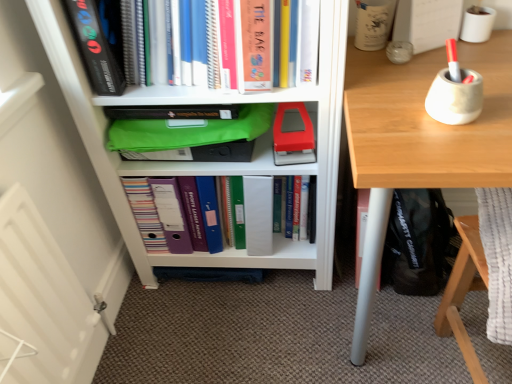
What is the approximate width of light wood desk at right?

24.68 inches.

What do you see at coordinates (399, 51) in the screenshot? The height and width of the screenshot is (384, 512). I see `clear glass jar at upper right, the second stationery in the left-to-right sequence` at bounding box center [399, 51].

The image size is (512, 384). Find the location of `clear glass jar at upper right, the second stationery in the left-to-right sequence`. clear glass jar at upper right, the second stationery in the left-to-right sequence is located at coordinates (399, 51).

You are a GUI agent. You are given a task and a screenshot of the screen. Output one action in this format:
    pyautogui.click(x=<x>, y=<y>)
    Task: Click on the matte red stapler at center, the second paperback book positioned from the left
    This screenshot has height=384, width=512.
    Given the screenshot: What is the action you would take?
    pyautogui.click(x=293, y=137)

Locate an element on the screen. Image resolution: width=512 pixels, height=384 pixels. matte plastic folder at center, which is counted as the third book, starting from the top is located at coordinates (170, 217).

Locate an element on the screen. matte green plastic bag at center is located at coordinates (211, 163).

Is matte green plastic bag at center in front of or behind matte red stapler at center, the 2th paperback book when ordered from top to bottom, in the image?

matte green plastic bag at center is in front of matte red stapler at center, the 2th paperback book when ordered from top to bottom.

Considering the positions of objects matte green plastic bag at center and matte red stapler at center, the 2th paperback book when ordered from top to bottom, in the image provided, who is more to the right, matte green plastic bag at center or matte red stapler at center, the 2th paperback book when ordered from top to bottom,?

matte red stapler at center, the 2th paperback book when ordered from top to bottom, is more to the right.

Is matte green plastic bag at center bigger or smaller than matte red stapler at center, the second paperback book positioned from the left?

In the image, matte green plastic bag at center appears to be larger than matte red stapler at center, the second paperback book positioned from the left.

Find the location of a particular element. bookcase located on the left of matte red stapler at center, the second paperback book positioned from the left is located at coordinates (211, 163).

From a real-world perspective, relative to matte plastic folder at center, which is counted as the third book, starting from the top, is white matte pen holder at upper right, the 1th stationery positioned from the right, vertically above or below?

From a real-world perspective, white matte pen holder at upper right, the 1th stationery positioned from the right, is physically above matte plastic folder at center, which is counted as the third book, starting from the top.

Between white matte pen holder at upper right, the 1th stationery positioned from the right, and matte plastic folder at center, which is the first book in bottom-to-top order, which one has larger width?

With larger width is matte plastic folder at center, which is the first book in bottom-to-top order.

Considering the relative positions of white matte pen holder at upper right, the 1th stationery positioned from the right, and matte plastic folder at center, which is counted as the third book, starting from the top, in the image provided, is white matte pen holder at upper right, the 1th stationery positioned from the right, to the left or to the right of matte plastic folder at center, which is counted as the third book, starting from the top,?

white matte pen holder at upper right, the 1th stationery positioned from the right, is positioned on matte plastic folder at center, which is counted as the third book, starting from the top,'s right side.

Considering the relative sizes of white matte pen holder at upper right, the 1th stationery positioned from the right, and matte plastic folder at center, which is the first book in bottom-to-top order, in the image provided, is white matte pen holder at upper right, the 1th stationery positioned from the right, smaller than matte plastic folder at center, which is the first book in bottom-to-top order,?

Indeed, white matte pen holder at upper right, the 1th stationery positioned from the right, has a smaller size compared to matte plastic folder at center, which is the first book in bottom-to-top order.

Considering the positions of objects matte gray pen holder at upper right, which appears as the 2th stationery when viewed from the right, and hardcover book at upper center, which is the third book in bottom-to-top order, in the image provided, who is in front, matte gray pen holder at upper right, which appears as the 2th stationery when viewed from the right, or hardcover book at upper center, which is the third book in bottom-to-top order,?

→ matte gray pen holder at upper right, which appears as the 2th stationery when viewed from the right.

Is point (456, 94) closer to camera compared to point (257, 83)?

That is True.

Is matte gray pen holder at upper right, which appears as the 2th stationery when viewed from the right, taller or shorter than hardcover book at upper center, which appears as the first book when viewed from the top?

Clearly, matte gray pen holder at upper right, which appears as the 2th stationery when viewed from the right, is shorter compared to hardcover book at upper center, which appears as the first book when viewed from the top.

Would you say matte gray pen holder at upper right, which appears as the 2th stationery when viewed from the right, is a long distance from hardcover book at upper center, which appears as the first book when viewed from the top?

That's not correct — matte gray pen holder at upper right, which appears as the 2th stationery when viewed from the right, is a little close to hardcover book at upper center, which appears as the first book when viewed from the top.

Is light wood desk at right thinner than white matte mug at upper right, which ranks as the 4th stationery in right-to-left order?

Incorrect, the width of light wood desk at right is not less than that of white matte mug at upper right, which ranks as the 4th stationery in right-to-left order.

From the image's perspective, relative to white matte mug at upper right, which ranks as the 4th stationery in right-to-left order, is light wood desk at right above or below?

Clearly, from the image's perspective, light wood desk at right is below white matte mug at upper right, which ranks as the 4th stationery in right-to-left order.

This screenshot has width=512, height=384. There is a light wood desk at right. What are the coordinates of `the 4th stationery above it (from a real-world perspective)` in the screenshot? It's located at (373, 23).

Relative to white matte mug at upper right, the first stationery from the left, is light wood desk at right in front or behind?

light wood desk at right is in front of white matte mug at upper right, the first stationery from the left.

From a real-world perspective, is light wood desk at right beneath white matte pen holder at upper right, the 1th stationery positioned from the right?

Yes, from a real-world perspective, light wood desk at right is below white matte pen holder at upper right, the 1th stationery positioned from the right.

Does light wood desk at right appear on the right side of white matte pen holder at upper right, the 1th stationery positioned from the right?

No, light wood desk at right is not to the right of white matte pen holder at upper right, the 1th stationery positioned from the right.

Is point (397, 148) closer to camera compared to point (490, 24)?

Yes, it is.

Can you confirm if light wood desk at right is shorter than white matte pen holder at upper right, the 1th stationery positioned from the right?

Incorrect, the height of light wood desk at right does not fall short of that of white matte pen holder at upper right, the 1th stationery positioned from the right.

This screenshot has width=512, height=384. In order to click on stationery that is the 1st object located above the matte red stapler at center, the second paperback book positioned from the left (from the image's perspective) in this screenshot , I will do `click(455, 97)`.

Is matte gray pen holder at upper right, which appears as the 2th stationery when viewed from the right, oriented towards matte red stapler at center, the 2th paperback book when ordered from top to bottom?

No, matte gray pen holder at upper right, which appears as the 2th stationery when viewed from the right, is not oriented towards matte red stapler at center, the 2th paperback book when ordered from top to bottom.

From a real-world perspective, between matte gray pen holder at upper right, which appears as the 2th stationery when viewed from the right, and matte red stapler at center, which appears as the first paperback book when viewed from the right, who is vertically higher?

In real-world perspective, matte gray pen holder at upper right, which appears as the 2th stationery when viewed from the right, is above.

Between matte gray pen holder at upper right, which appears as the 2th stationery when viewed from the right, and matte red stapler at center, which appears as the 1th paperback book when ordered from the bottom, which one is positioned behind?

matte red stapler at center, which appears as the 1th paperback book when ordered from the bottom, is further from the camera.

Is green fabric bag at center completely or partially inside hardcover book at upper left, positioned as the 1th paperback book in left-to-right order?

No, green fabric bag at center is not inside hardcover book at upper left, positioned as the 1th paperback book in left-to-right order.

Which is behind, point (101, 54) or point (133, 158)?

Positioned behind is point (133, 158).

Can you confirm if hardcover book at upper left, arranged as the first paperback book when viewed from the top, is taller than green fabric bag at center?

Yes, hardcover book at upper left, arranged as the first paperback book when viewed from the top, is taller than green fabric bag at center.

From the image's perspective, is hardcover book at upper left, positioned as the 1th paperback book in left-to-right order, located above green fabric bag at center?

Yes.

Image resolution: width=512 pixels, height=384 pixels. I want to click on paperback book to the right of matte green plastic bag at center, so pos(293,137).

In order to click on book that is the 1st object located behind the white matte pen holder at upper right, the 1th stationery positioned from the right in this screenshot , I will do `click(170, 217)`.

Looking at the image, which one is located further to green fabric bag at center, matte red stapler at center, the second paperback book positioned from the left, or light wood desk at right?

Based on the image, light wood desk at right appears to be further to green fabric bag at center.

Estimate the real-world distances between objects in this image. Which object is closer to hardcover book at upper center, which is the third book in bottom-to-top order, hardcover book at center, arranged as the 2th book when ordered from the bottom, or green fabric bag at center?

Among the two, green fabric bag at center is located nearer to hardcover book at upper center, which is the third book in bottom-to-top order.

From the image, which object appears to be nearer to light wood desk at right, matte red stapler at center, the 2th paperback book when ordered from top to bottom, or white matte pen holder at upper right, positioned as the fourth stationery in left-to-right order?

matte red stapler at center, the 2th paperback book when ordered from top to bottom, is positioned closer to the anchor light wood desk at right.

Estimate the real-world distances between objects in this image. Which object is further from light wood desk at right, matte gray pen holder at upper right, which is the 3th stationery from left to right, or matte plastic folder at center, which is the first book in bottom-to-top order?

matte plastic folder at center, which is the first book in bottom-to-top order, is positioned further to the anchor light wood desk at right.

From the image, which object appears to be nearer to matte red stapler at center, the 2th paperback book when ordered from top to bottom, matte green plastic bag at center or green fabric bag at center?

green fabric bag at center.

When comparing their distances from white matte pen holder at upper right, positioned as the fourth stationery in left-to-right order, does hardcover book at center, arranged as the 2th book when ordered from the bottom, or matte gray pen holder at upper right, which is the 3th stationery from left to right, seem closer?

matte gray pen holder at upper right, which is the 3th stationery from left to right, is positioned closer to the anchor white matte pen holder at upper right, positioned as the fourth stationery in left-to-right order.

Considering their positions, is light wood desk at right positioned further to green fabric bag at center than clear glass jar at upper right, the second stationery in the left-to-right sequence?

clear glass jar at upper right, the second stationery in the left-to-right sequence, lies further to green fabric bag at center than the other object.

Estimate the real-world distances between objects in this image. Which object is closer to green fabric bag at center, light wood desk at right or matte plastic folder at center, which is counted as the third book, starting from the top?

Among the two, matte plastic folder at center, which is counted as the third book, starting from the top, is located nearer to green fabric bag at center.

This screenshot has height=384, width=512. I want to click on shelf located between matte green plastic bag at center and matte plastic folder at center, which is the first book in bottom-to-top order, in the depth direction, so click(191, 137).

The image size is (512, 384). I want to click on bookcase between hardcover book at upper left, positioned as the 1th paperback book in left-to-right order, and white matte mug at upper right, which ranks as the 4th stationery in right-to-left order, from left to right, so click(x=211, y=163).

In order to click on bookcase between matte plastic folder at center, which is counted as the third book, starting from the top, and white matte pen holder at upper right, positioned as the fourth stationery in left-to-right order, from left to right in this screenshot , I will do `click(211, 163)`.

This screenshot has width=512, height=384. I want to click on book between hardcover book at upper center, which appears as the first book when viewed from the top, and matte plastic folder at center, which is counted as the third book, starting from the top, vertically, so click(302, 206).